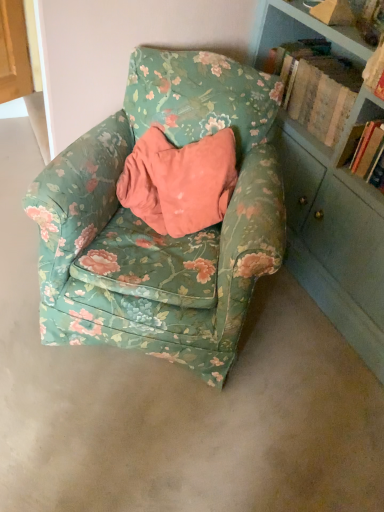
Where is `blank space situated above wooden book at upper right, the first book from the top (from a real-world perspective)`? The image size is (384, 512). blank space situated above wooden book at upper right, the first book from the top (from a real-world perspective) is located at coordinates (338, 62).